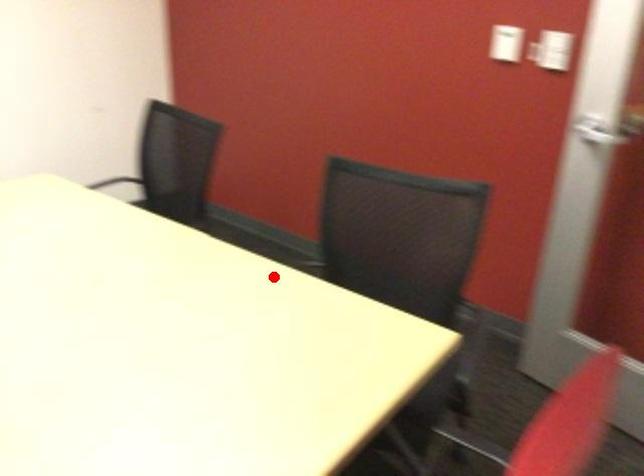
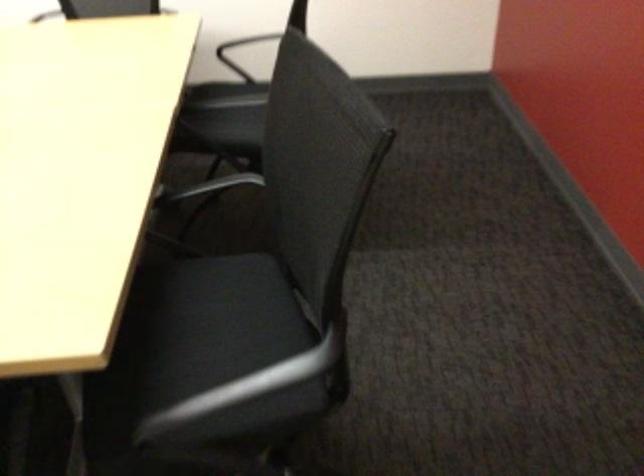
Question: I am providing you with two images of the same scene from different viewpoints. Given a red point in image1, look at the same physical point in image2. Is it:

Choices:
 (A) Closer to the viewpoint
 (B) Farther from the viewpoint

Answer: (A)